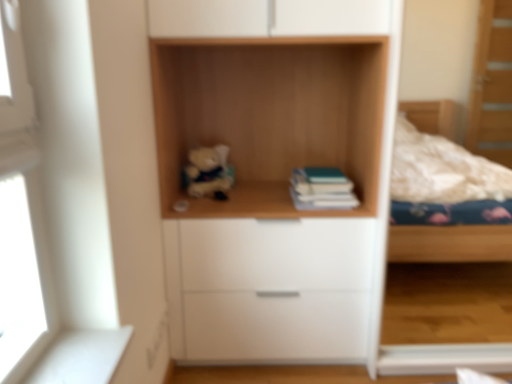
Identify the location of vacant space to the right of soft plush bear at center. click(247, 194).